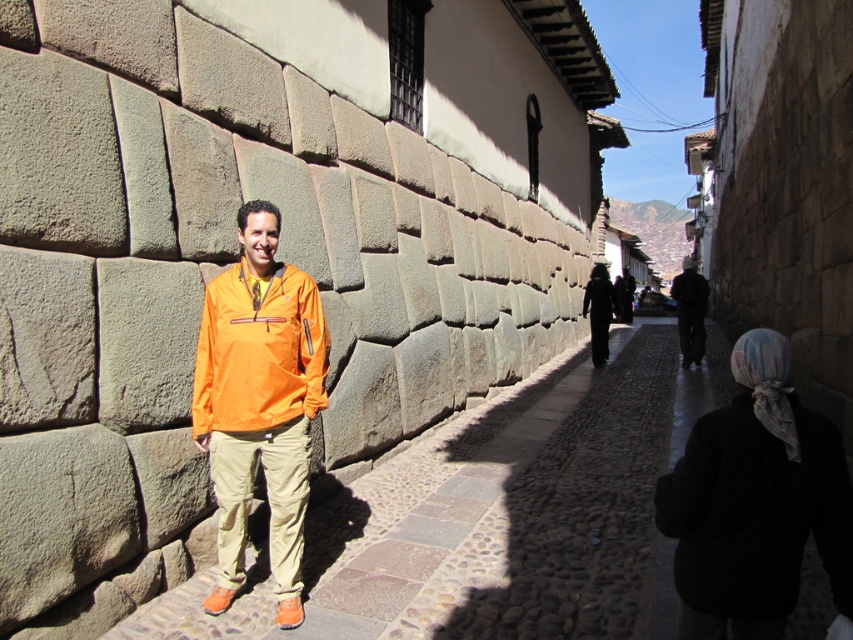
Question: Which point appears farthest from the camera in this image?

Choices:
 (A) (695, 337)
 (B) (776, 524)
 (C) (271, 554)

Answer: (A)

Question: Which object is closer to the camera taking this photo?

Choices:
 (A) dark gray wool coat at center
 (B) cobblestone pavement at center
 (C) orange fabric jacket at center

Answer: (B)

Question: Observing the image, what is the correct spatial positioning of black fabric headscarf at lower right in reference to orange fabric jacket at center?

Choices:
 (A) right
 (B) left

Answer: (A)

Question: Can you confirm if cobblestone pavement at center is smaller than matte orange jacket at center?

Choices:
 (A) yes
 (B) no

Answer: (B)

Question: Does cobblestone pavement at center come behind matte orange jacket at center?

Choices:
 (A) no
 (B) yes

Answer: (A)

Question: Which object appears farthest from the camera in this image?

Choices:
 (A) dark gray wool coat at center
 (B) orange fabric jacket at center

Answer: (A)